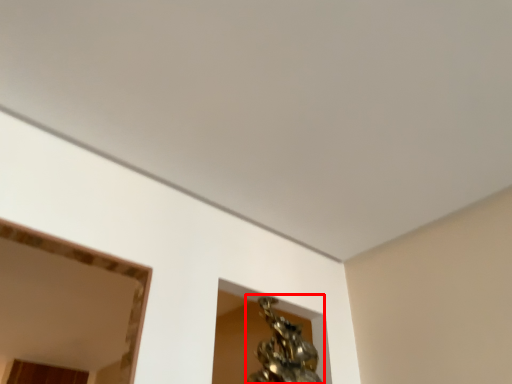
Question: In this image, where is bronze sculpture (annotated by the red box) located relative to mirror?

Choices:
 (A) right
 (B) left

Answer: (A)